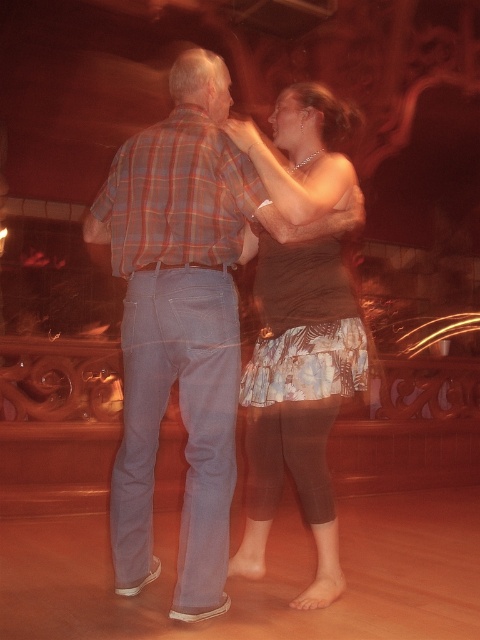
Question: Observing the image, what is the correct spatial positioning of plaid shirt at center in reference to plaid fabric shirt at upper center?

Choices:
 (A) below
 (B) above

Answer: (A)

Question: Which point is farther to the camera?

Choices:
 (A) matte brown blouse at center
 (B) plaid fabric shirt at upper center
 (C) plaid shirt at center

Answer: (B)

Question: Observing the image, what is the correct spatial positioning of plaid shirt at center in reference to plaid fabric shirt at upper center?

Choices:
 (A) below
 (B) above

Answer: (A)

Question: Which point is farther to the camera?

Choices:
 (A) (235, 202)
 (B) (118, 490)

Answer: (B)

Question: Which object is closer to the camera taking this photo?

Choices:
 (A) matte brown blouse at center
 (B) plaid shirt at center

Answer: (B)

Question: Does plaid shirt at center have a greater width compared to matte brown blouse at center?

Choices:
 (A) no
 (B) yes

Answer: (B)